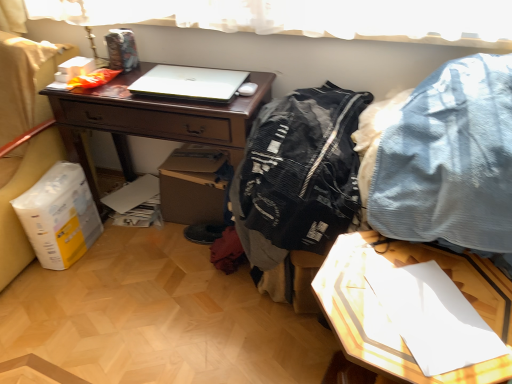
Locate an element on the screen. The height and width of the screenshot is (384, 512). free point above white glossy paper at lower right (from a real-world perspective) is located at coordinates (422, 298).